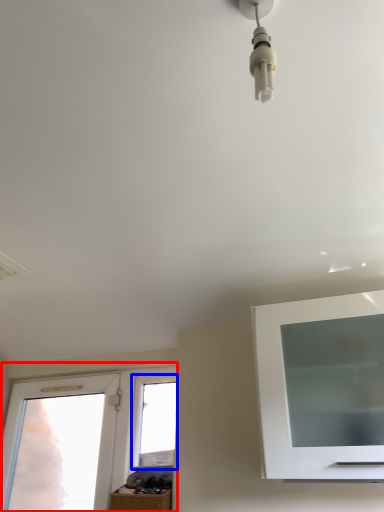
Question: Which object appears farthest to the camera in this image, window (highlighted by a red box) or window (highlighted by a blue box)?

Choices:
 (A) window
 (B) window

Answer: (B)